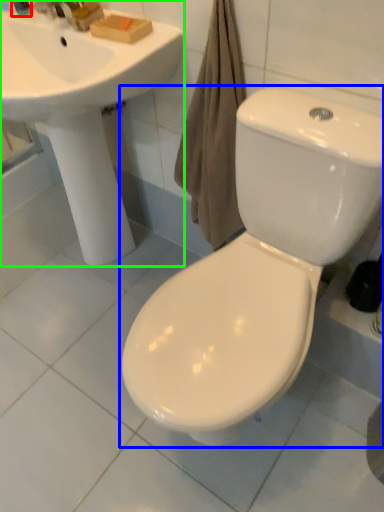
Question: Considering the real-world distances, which object is closest to toiletry (highlighted by a red box)? toilet (highlighted by a blue box) or sink (highlighted by a green box).

Choices:
 (A) toilet
 (B) sink

Answer: (B)